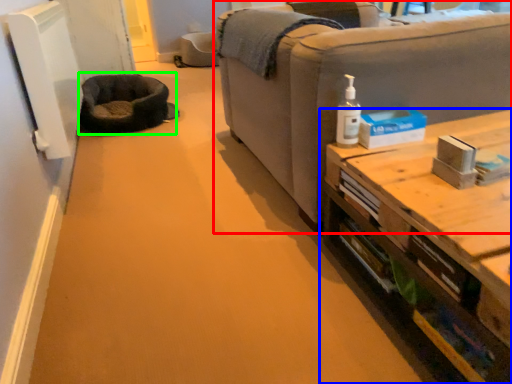
Question: Estimate the real-world distances between objects in this image. Which object is farther from studio couch (highlighted by a red box), table (highlighted by a blue box) or cat bed (highlighted by a green box)?

Choices:
 (A) table
 (B) cat bed

Answer: (B)